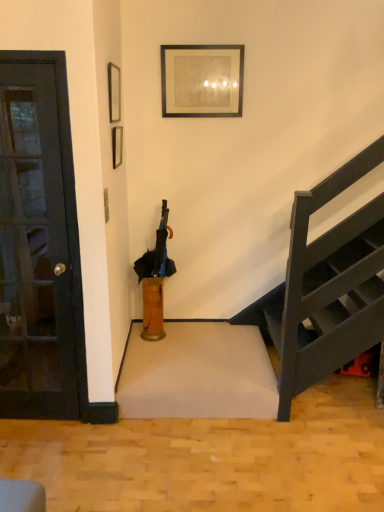
Question: Is translucent glass vase at center bigger or smaller than black matte umbrella at center?

Choices:
 (A) small
 (B) big

Answer: (A)

Question: Is translucent glass vase at center wider or thinner than black matte umbrella at center?

Choices:
 (A) thin
 (B) wide

Answer: (A)

Question: Considering the real-world distances, which object is closest to the translucent glass vase at center?

Choices:
 (A) black glass door at left
 (B) black matte umbrella at center
 (C) matte black picture frame at upper left, the second picture frame viewed from the right
 (D) black matte picture frame at upper center, the first picture frame positioned from the back

Answer: (B)

Question: Estimate the real-world distances between objects in this image. Which object is farther from the black glass door at left?

Choices:
 (A) translucent glass vase at center
 (B) black matte umbrella at center
 (C) matte black picture frame at upper left, which appears as the first picture frame when viewed from the front
 (D) black matte picture frame at upper center, the second picture frame positioned from the left

Answer: (D)